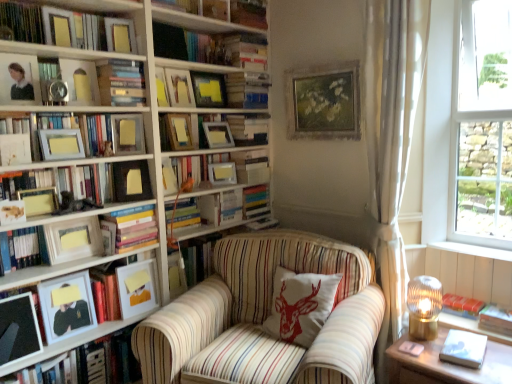
Where is `free space above hardcover book at right, the 4th book when ordered from bottom to top (from a real-world perspective)`? free space above hardcover book at right, the 4th book when ordered from bottom to top (from a real-world perspective) is located at coordinates (457, 298).